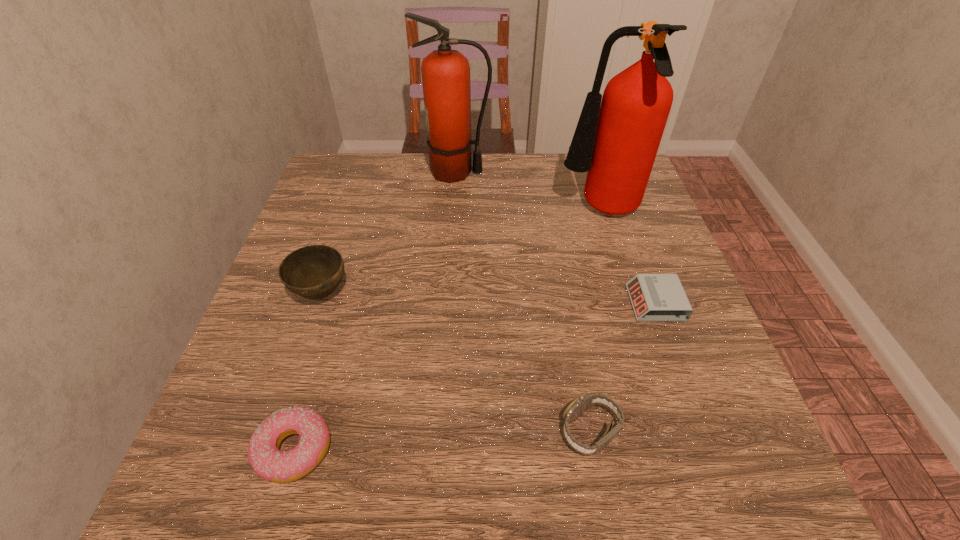
Locate an element on the screen. the fifth nearest object is located at coordinates (616, 140).

Where is `the right fire extinguisher`? the right fire extinguisher is located at coordinates coord(616,140).

Locate an element on the screen. This screenshot has height=540, width=960. the farther fire extinguisher is located at coordinates (445, 73).

I want to click on the fourth object from right to left, so click(445, 73).

The width and height of the screenshot is (960, 540). What are the coordinates of `bowl` in the screenshot? It's located at (314, 272).

The image size is (960, 540). Find the location of `watch`. watch is located at coordinates (581, 403).

Find the location of a particular element. The width and height of the screenshot is (960, 540). the fifth tallest object is located at coordinates (271, 464).

Find the location of `the shortest object`. the shortest object is located at coordinates (655, 297).

Find the location of `vacant area located 0.270m at the nozzle of the fifth nearest object`. vacant area located 0.270m at the nozzle of the fifth nearest object is located at coordinates (448, 211).

I want to click on free space located at the nozzle of the fifth nearest object, so click(477, 211).